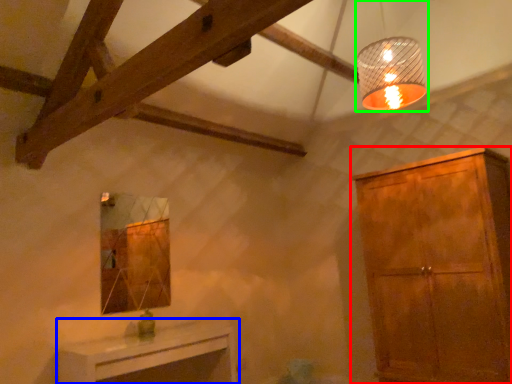
Question: Which is farther away from cabinetry (highlighted by a red box)? table (highlighted by a blue box) or lamp (highlighted by a green box)?

Choices:
 (A) table
 (B) lamp

Answer: (A)